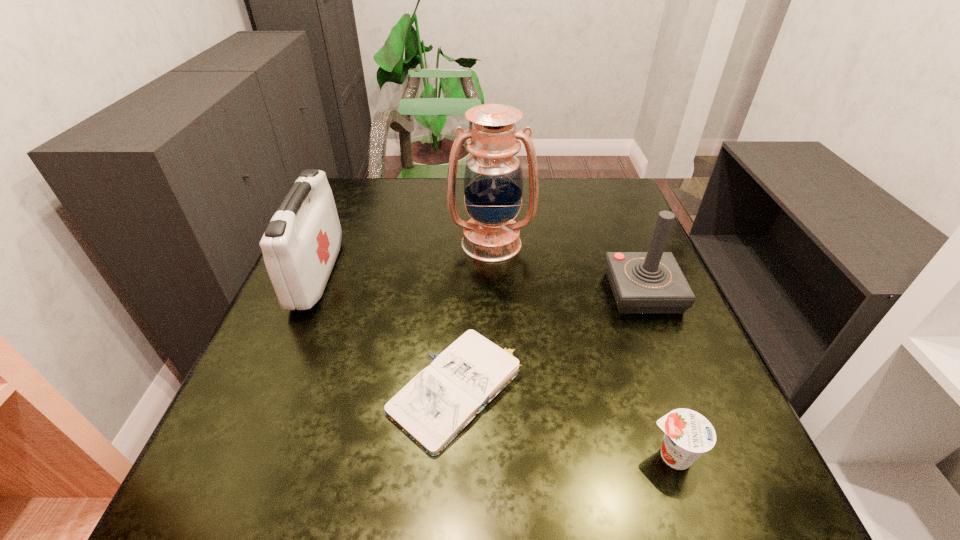
Image resolution: width=960 pixels, height=540 pixels. What are the coordinates of `free space between the yogurt and the joystick` in the screenshot? It's located at (658, 374).

Where is `vacant point located between the joystick and the oil lamp`? The image size is (960, 540). vacant point located between the joystick and the oil lamp is located at coordinates (567, 268).

The height and width of the screenshot is (540, 960). Find the location of `unoccupied position between the shortest object and the oil lamp`. unoccupied position between the shortest object and the oil lamp is located at coordinates (475, 316).

The height and width of the screenshot is (540, 960). In order to click on empty space between the joystick and the shortest object in this screenshot , I will do `click(551, 341)`.

What are the coordinates of `free space between the shortest object and the leftmost object` in the screenshot? It's located at (388, 332).

Find the location of a particular element. The width and height of the screenshot is (960, 540). free space between the joystick and the second shortest object is located at coordinates (658, 374).

You are a GUI agent. You are given a task and a screenshot of the screen. Output one action in this format:
    pyautogui.click(x=<x>, y=<y>)
    Task: Click on the vacant region between the joystick and the oil lamp
    
    Given the screenshot: What is the action you would take?
    pyautogui.click(x=567, y=268)

Locate an element on the screen. The image size is (960, 540). free spot between the fourth tallest object and the tallest object is located at coordinates (582, 349).

At what (x,y) coordinates should I click in order to perform the action: click on free spot between the first-aid kit and the oil lamp. Please return your answer as a coordinate pair (x, y). The image size is (960, 540). Looking at the image, I should click on (404, 259).

In order to click on object identified as the second closest to the yogurt in this screenshot , I will do [652, 282].